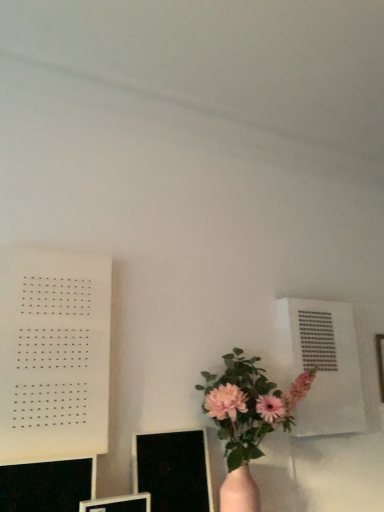
Question: Visually, is black glossy computer monitor at lower center, which appears as the 3th computer monitor when viewed from the left, positioned to the left or to the right of white paper at left?

Choices:
 (A) right
 (B) left

Answer: (A)

Question: Which is correct: black glossy computer monitor at lower center, which appears as the 3th computer monitor when viewed from the left, is inside white paper at left, or outside of it?

Choices:
 (A) inside
 (B) outside

Answer: (B)

Question: Based on their relative distances, which object is farther from the matte black monitor at lower left, the 2th computer monitor from the left?

Choices:
 (A) black glossy computer monitor at lower left, the first computer monitor viewed from the left
 (B) white paper at left
 (C) black glossy computer monitor at lower center, which appears as the 3th computer monitor when viewed from the left
 (D) pink matte vase at lower center

Answer: (D)

Question: Estimate the real-world distances between objects in this image. Which object is farther from the white paper at left?

Choices:
 (A) black glossy computer monitor at lower left, the first computer monitor viewed from the left
 (B) pink matte vase at lower center
 (C) matte black monitor at lower left, the 2th computer monitor from the left
 (D) black glossy computer monitor at lower center, acting as the first computer monitor starting from the right

Answer: (B)